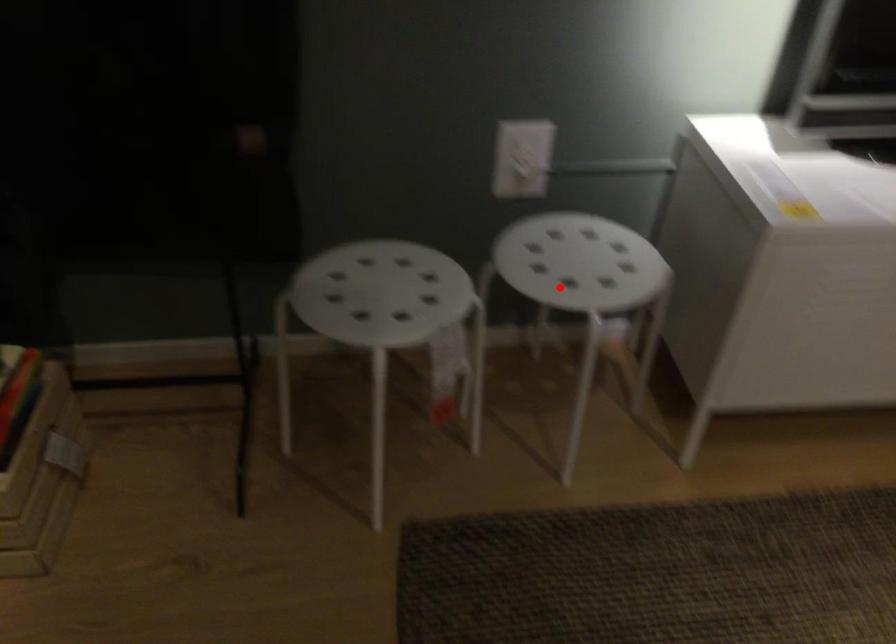
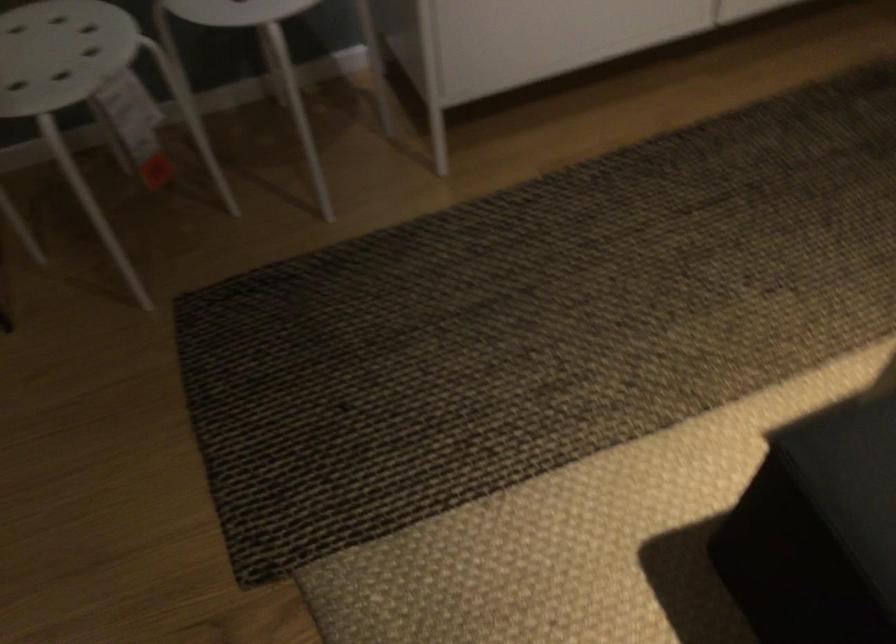
The point at the highlighted location is marked in the first image. Where is the corresponding point in the second image?

(235, 11)